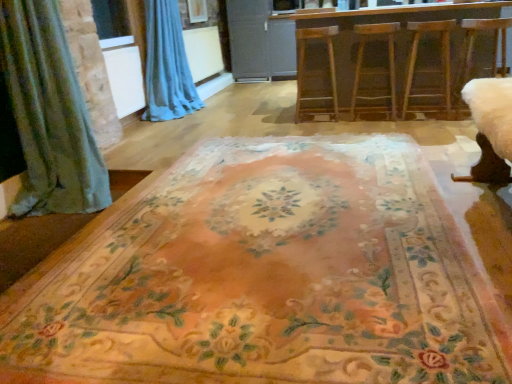
The image size is (512, 384). What do you see at coordinates (304, 64) in the screenshot?
I see `wooden stool at center, acting as the 3th armchair starting from the right` at bounding box center [304, 64].

What is the approximate width of wooden stool at center, acting as the first armchair starting from the left?

It is 14.33 inches.

Where is `matte gray screen door at center`? The height and width of the screenshot is (384, 512). matte gray screen door at center is located at coordinates (249, 38).

Where is `wooden stool at right, placed as the 1th armchair when sorted from right to left`? wooden stool at right, placed as the 1th armchair when sorted from right to left is located at coordinates (442, 66).

Describe the element at coordinates (473, 50) in the screenshot. The height and width of the screenshot is (384, 512). I see `white fabric swivel chair at right` at that location.

Measure the distance between point [489,314] and camera.

Point [489,314] is 1.41 meters from camera.

Find the location of a particular element. The width and height of the screenshot is (512, 384). wooden barstools at center is located at coordinates (384, 59).

Can you tell me how much clear plastic window screen at upper left and wooden stool at center, the 2th armchair when ordered from left to right, differ in facing direction?

The angular difference between clear plastic window screen at upper left and wooden stool at center, the 2th armchair when ordered from left to right, is 85.6 degrees.

In terms of width, does clear plastic window screen at upper left look wider or thinner when compared to wooden stool at center, the 2th armchair when ordered from left to right?

Considering their sizes, clear plastic window screen at upper left looks slimmer than wooden stool at center, the 2th armchair when ordered from left to right.

Image resolution: width=512 pixels, height=384 pixels. What are the coordinates of `window screen lying above the wooden stool at center, the 2th armchair when ordered from left to right (from the image's perspective)` in the screenshot? It's located at (111, 20).

From the image's perspective, which one is positioned higher, clear plastic window screen at upper left or wooden stool at center, positioned as the 2th armchair in right-to-left order?

clear plastic window screen at upper left appears higher in the image.

In the scene shown: Which object is further away from the camera, wooden stool at center, positioned as the 2th armchair in right-to-left order, or white fabric swivel chair at right?

Positioned behind is wooden stool at center, positioned as the 2th armchair in right-to-left order.

Is wooden stool at center, the 2th armchair when ordered from left to right, thinner than white fabric swivel chair at right?

Yes.

Is point (390, 97) more distant than point (500, 26)?

Yes, point (390, 97) is farther from viewer.

From the image's perspective, does wooden stool at center, positioned as the 2th armchair in right-to-left order, appear lower than white fabric swivel chair at right?

No, from the image's perspective, wooden stool at center, positioned as the 2th armchair in right-to-left order, is not beneath white fabric swivel chair at right.

Would you consider matte gray screen door at center to be distant from white fabric swivel chair at right?

Absolutely, matte gray screen door at center is distant from white fabric swivel chair at right.

Based on the photo, which of these two, matte gray screen door at center or white fabric swivel chair at right, stands shorter?

Standing shorter between the two is white fabric swivel chair at right.

Does point (265, 46) appear closer or farther from the camera than point (503, 68)?

Point (265, 46) is farther from the camera than point (503, 68).

From the image's perspective, relative to white fabric swivel chair at right, is matte gray screen door at center above or below?

matte gray screen door at center is above white fabric swivel chair at right.

Between blue fabric curtain at upper left and matte gray screen door at center, which one appears on the left side from the viewer's perspective?

blue fabric curtain at upper left.

From the image's perspective, is blue fabric curtain at upper left located above or below matte gray screen door at center?

Based on their image positions, blue fabric curtain at upper left is located beneath matte gray screen door at center.

Considering the sizes of objects blue fabric curtain at upper left and matte gray screen door at center in the image provided, who is bigger, blue fabric curtain at upper left or matte gray screen door at center?

Bigger between the two is blue fabric curtain at upper left.

Based on the photo, from a real-world perspective, does blue fabric curtain at upper left stand above clear plastic window screen at upper left?

No, from a real-world perspective, blue fabric curtain at upper left is not on top of clear plastic window screen at upper left.

In the scene shown: Does blue fabric curtain at upper left have a greater width compared to clear plastic window screen at upper left?

Yes.

Is blue fabric curtain at upper left to the left or to the right of clear plastic window screen at upper left in the image?

Based on their positions, blue fabric curtain at upper left is located to the right of clear plastic window screen at upper left.

In the image, is blue fabric curtain at upper left positioned in front of or behind clear plastic window screen at upper left?

blue fabric curtain at upper left is positioned farther from the viewer than clear plastic window screen at upper left.

Measure the distance between wooden stool at right, which ranks as the 3th armchair in left-to-right order, and blue fabric curtain at upper left.

wooden stool at right, which ranks as the 3th armchair in left-to-right order, is 2.38 meters from blue fabric curtain at upper left.

Which is closer, (431,27) or (193,101)?

Point (431,27).

The height and width of the screenshot is (384, 512). I want to click on curtain on the left of wooden stool at right, placed as the 1th armchair when sorted from right to left, so click(x=167, y=65).

Between wooden stool at right, which ranks as the 3th armchair in left-to-right order, and blue fabric curtain at upper left, which one has smaller size?

wooden stool at right, which ranks as the 3th armchair in left-to-right order.

From the picture: Is wooden stool at center, acting as the first armchair starting from the left, taller than matte gray screen door at center?

No.

From a real-world perspective, which object stands above the other?

From a 3D spatial view, matte gray screen door at center is above.

Based on the photo, do you think wooden stool at center, acting as the first armchair starting from the left, is within matte gray screen door at center, or outside of it?

wooden stool at center, acting as the first armchair starting from the left, is spatially situated outside matte gray screen door at center.

From the image's perspective, is wooden stool at center, acting as the 3th armchair starting from the right, below matte gray screen door at center?

Indeed, from the image's perspective, wooden stool at center, acting as the 3th armchair starting from the right, is shown beneath matte gray screen door at center.

Locate an element on the screen. the 2nd armchair positioned below the clear plastic window screen at upper left (from the image's perspective) is located at coordinates (362, 60).

At what (x,y) coordinates should I click in order to perform the action: click on swivel chair lying in front of the wooden stool at center, positioned as the 2th armchair in right-to-left order. Please return your answer as a coordinate pair (x, y). Looking at the image, I should click on coord(473,50).

From the image, which object appears to be nearer to blue fabric curtain at upper left, wooden barstools at center or wooden stool at center, the 2th armchair when ordered from left to right?

wooden barstools at center.

Based on their spatial positions, is wooden stool at center, acting as the first armchair starting from the left, or wooden stool at center, positioned as the 2th armchair in right-to-left order, closer to clear plastic window screen at upper left?

The object closer to clear plastic window screen at upper left is wooden stool at center, acting as the first armchair starting from the left.

Looking at the image, which one is located closer to wooden stool at right, placed as the 1th armchair when sorted from right to left, wooden stool at center, the 2th armchair when ordered from left to right, or clear plastic window screen at upper left?

wooden stool at center, the 2th armchair when ordered from left to right.

Based on their spatial positions, is wooden stool at center, acting as the 3th armchair starting from the right, or wooden stool at center, positioned as the 2th armchair in right-to-left order, further from blue fabric curtain at upper left?

wooden stool at center, positioned as the 2th armchair in right-to-left order, is further to blue fabric curtain at upper left.

Estimate the real-world distances between objects in this image. Which object is further from wooden stool at right, which ranks as the 3th armchair in left-to-right order, floral carpet at center or wooden stool at center, positioned as the 2th armchair in right-to-left order?

The object further to wooden stool at right, which ranks as the 3th armchair in left-to-right order, is floral carpet at center.

Looking at the image, which one is located further to clear plastic window screen at upper left, wooden stool at center, the 2th armchair when ordered from left to right, or matte gray screen door at center?

wooden stool at center, the 2th armchair when ordered from left to right.

Looking at the image, which one is located closer to wooden stool at center, acting as the 3th armchair starting from the right, wooden stool at center, positioned as the 2th armchair in right-to-left order, or white fabric swivel chair at right?

wooden stool at center, positioned as the 2th armchair in right-to-left order.

Estimate the real-world distances between objects in this image. Which object is closer to floral carpet at center, wooden stool at right, which ranks as the 3th armchair in left-to-right order, or blue fabric curtain at upper left?

wooden stool at right, which ranks as the 3th armchair in left-to-right order, lies closer to floral carpet at center than the other object.

Find the location of a particular element. This screenshot has width=512, height=384. table between floral carpet at center and clear plastic window screen at upper left in the front-back direction is located at coordinates (384, 59).

Find the location of `table between clear plastic window screen at upper left and wooden stool at right, which ranks as the 3th armchair in left-to-right order, from left to right`. table between clear plastic window screen at upper left and wooden stool at right, which ranks as the 3th armchair in left-to-right order, from left to right is located at coordinates (384, 59).

I want to click on swivel chair located between floral carpet at center and blue fabric curtain at upper left in the depth direction, so click(473, 50).

This screenshot has width=512, height=384. Find the location of `window screen between floral carpet at center and matte gray screen door at center along the z-axis`. window screen between floral carpet at center and matte gray screen door at center along the z-axis is located at coordinates (111, 20).